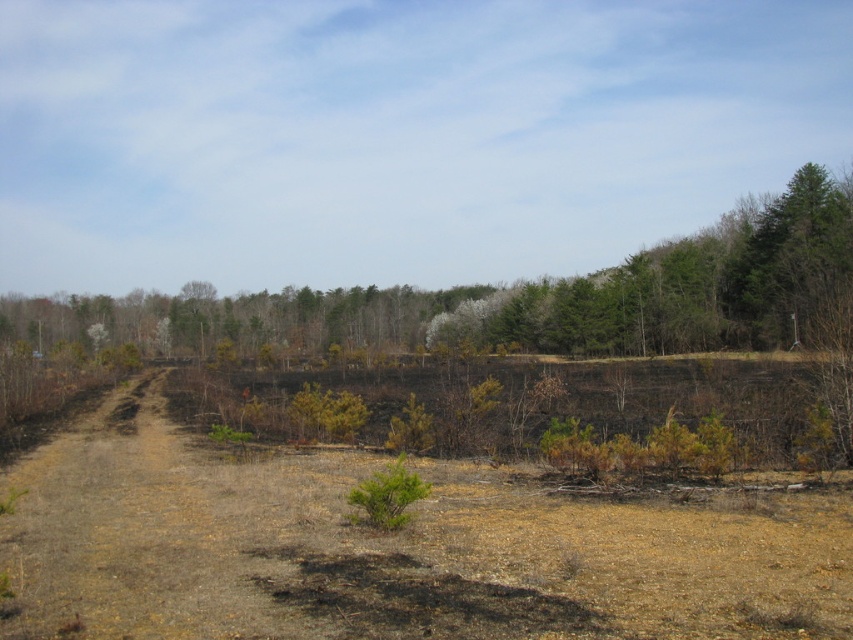
Question: Does brown dry grass at center have a greater width compared to green matte tree at upper right?

Choices:
 (A) yes
 (B) no

Answer: (B)

Question: Is brown dry grass at center further to the viewer compared to green matte tree at upper right?

Choices:
 (A) no
 (B) yes

Answer: (A)

Question: Among these points, which one is farthest from the camera?

Choices:
 (A) (781, 252)
 (B) (109, 572)

Answer: (A)

Question: Observing the image, what is the correct spatial positioning of brown dry grass at center in reference to green matte tree at upper right?

Choices:
 (A) left
 (B) right

Answer: (A)